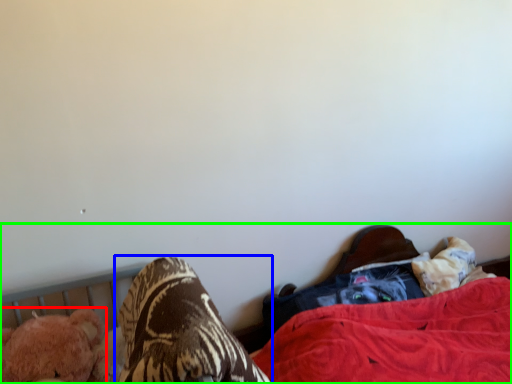
Question: Which object is positioned closest to animal (highlighted by a red box)? Select from footwear (highlighted by a blue box) and bed (highlighted by a green box).

Choices:
 (A) footwear
 (B) bed

Answer: (A)